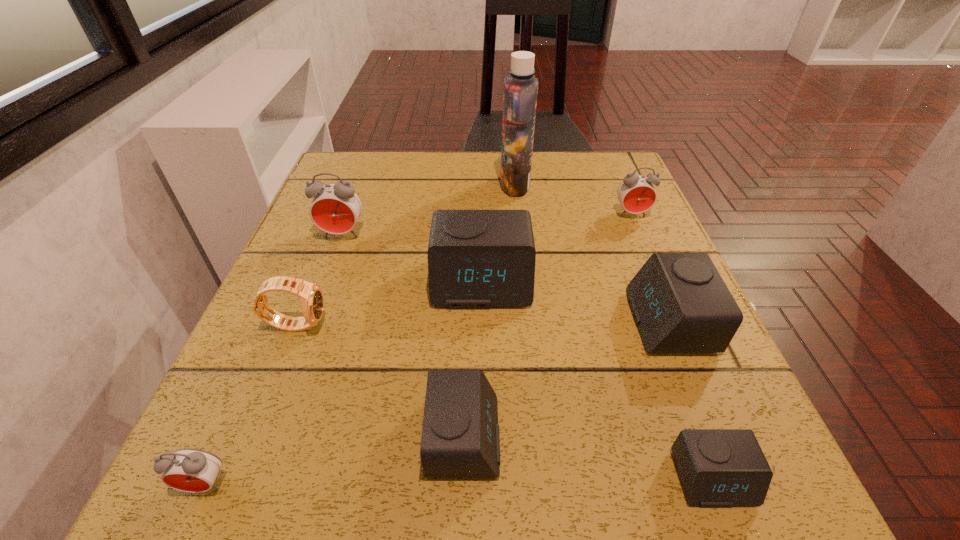
Identify which red alarm clock is the second closest to the shortest object. Please provide its 2D coordinates. Your answer should be formatted as a tuple, i.e. [(x, y)], where the tuple contains the x and y coordinates of a point satisfying the conditions above.

[(191, 470)]

The height and width of the screenshot is (540, 960). What are the coordinates of `black alarm clock that stands as the fourth closest to the tallest object` in the screenshot? It's located at (718, 467).

At what (x,y) coordinates should I click in order to perform the action: click on the closest black alarm clock relative to the farthest object. Please return your answer as a coordinate pair (x, y). Looking at the image, I should click on (476, 258).

This screenshot has width=960, height=540. What are the coordinates of `free point that satisfies the following two spatial constraints: 1. on the front-facing side of the third smallest black alarm clock; 2. on the front-facing side of the shortest object` in the screenshot? It's located at (733, 478).

Find the location of a particular element. vacant area in the image that satisfies the following two spatial constraints: 1. on the face of the farthest alarm clock; 2. on the front-facing side of the second smallest black alarm clock is located at coordinates (728, 436).

At what (x,y) coordinates should I click in order to perform the action: click on vacant space that satisfies the following two spatial constraints: 1. on the front label of the shampoo; 2. on the face of the second farthest red alarm clock. Please return your answer as a coordinate pair (x, y). Image resolution: width=960 pixels, height=540 pixels. Looking at the image, I should click on (520, 234).

Image resolution: width=960 pixels, height=540 pixels. In order to click on vacant space that satisfies the following two spatial constraints: 1. on the front-facing side of the third smallest black alarm clock; 2. on the front-facing side of the shortest object in this screenshot , I will do `click(733, 478)`.